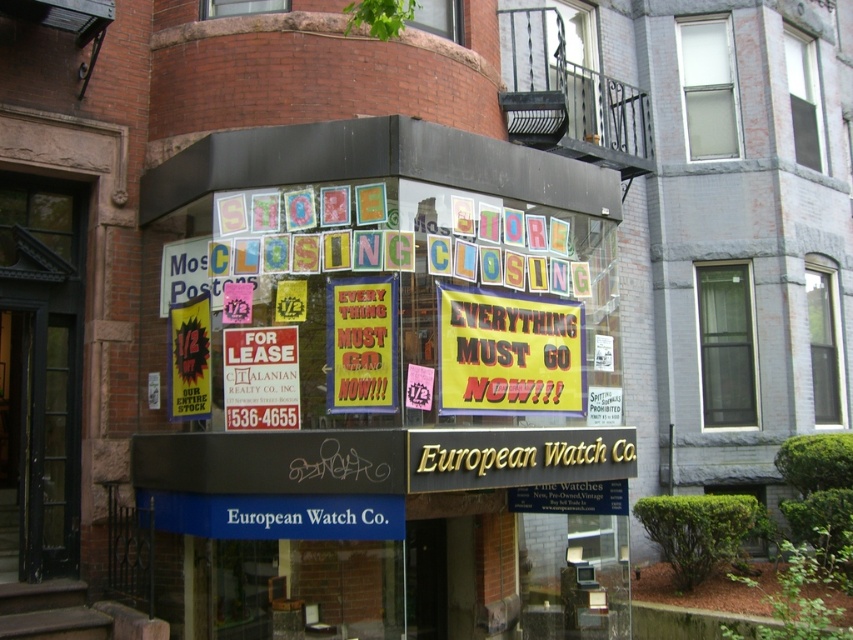
Question: Which point is closer to the camera taking this photo?

Choices:
 (A) (575, 602)
 (B) (350, 291)
 (C) (491, 358)

Answer: (B)

Question: Can you confirm if yellow paper posters at center is positioned above yellowmaterial/textureposter at center?

Choices:
 (A) yes
 (B) no

Answer: (A)

Question: Which of the following is the farthest from the observer?

Choices:
 (A) (177, 486)
 (B) (392, 330)

Answer: (A)

Question: Can you confirm if yellow paper posters at center is positioned below yellow/yellowish paper sign at center?

Choices:
 (A) no
 (B) yes

Answer: (A)

Question: Does yellow paper posters at center have a lesser width compared to yellow/yellowish paper sign at center?

Choices:
 (A) yes
 (B) no

Answer: (A)

Question: Which point appears farthest from the camera in this image?

Choices:
 (A) (386, 308)
 (B) (534, 403)
 (C) (463, 589)

Answer: (C)